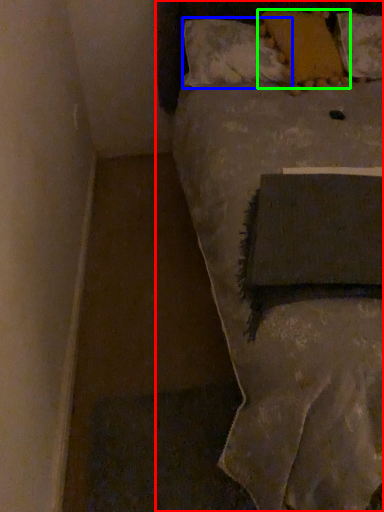
Question: Which object is the farthest from bed (highlighted by a red box)? Choose among these: pillow (highlighted by a blue box) or pillow (highlighted by a green box).

Choices:
 (A) pillow
 (B) pillow

Answer: (B)